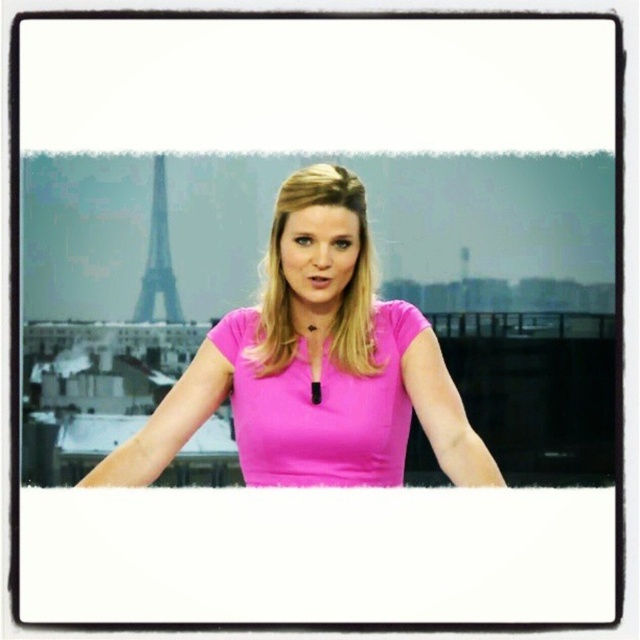
Question: Can you confirm if pink matte dress at center is bigger than matte pink dress at center?

Choices:
 (A) yes
 (B) no

Answer: (A)

Question: Which point is closer to the camera?

Choices:
 (A) (157, 156)
 (B) (280, 268)
 (C) (248, 460)

Answer: (B)

Question: Which point is closer to the camera?

Choices:
 (A) pink matte dress at center
 (B) matte pink dress at center

Answer: (A)

Question: Does pink matte dress at center appear on the left side of metallic gray eiffel tower at upper left?

Choices:
 (A) yes
 (B) no

Answer: (B)

Question: Is pink matte dress at center positioned at the back of metallic gray eiffel tower at upper left?

Choices:
 (A) no
 (B) yes

Answer: (A)

Question: Which of these objects is positioned closest to the metallic gray eiffel tower at upper left?

Choices:
 (A) pink matte dress at center
 (B) matte pink dress at center

Answer: (A)